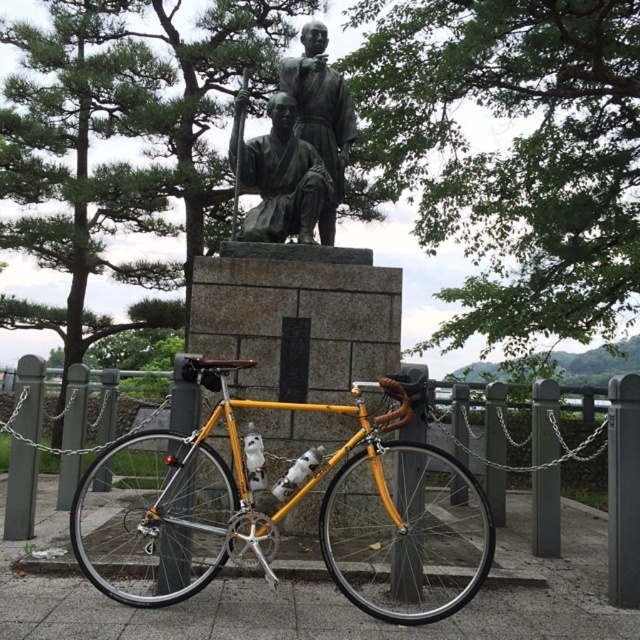
Question: Which point is farther to the camera?

Choices:
 (A) (253, 401)
 (B) (305, 189)
 (C) (352, 136)

Answer: (C)

Question: Can you confirm if yellow metallic bicycle at center is smaller than bronze statue at center?

Choices:
 (A) no
 (B) yes

Answer: (A)

Question: Is bronze statue at center thinner than bronze statue at upper center?

Choices:
 (A) yes
 (B) no

Answer: (B)

Question: Estimate the real-world distances between objects in this image. Which object is closer to the yellow metallic bicycle at center?

Choices:
 (A) bronze statue at upper center
 (B) bronze statue at center

Answer: (B)

Question: Is bronze statue at center wider than bronze statue at upper center?

Choices:
 (A) no
 (B) yes

Answer: (B)

Question: Which point is closer to the camera taking this photo?

Choices:
 (A) (262, 227)
 (B) (452, 532)

Answer: (A)